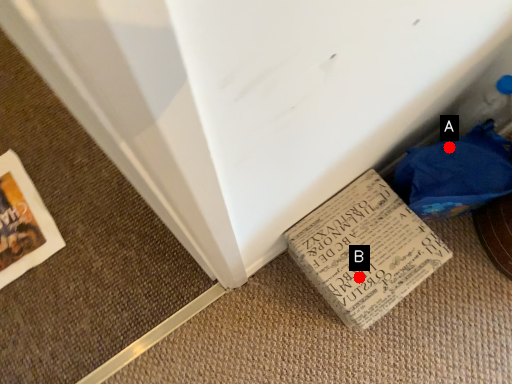
Question: Two points are circled on the image, labeled by A and B beside each circle. Which point is further to the camera?

Choices:
 (A) A is further
 (B) B is further

Answer: (A)